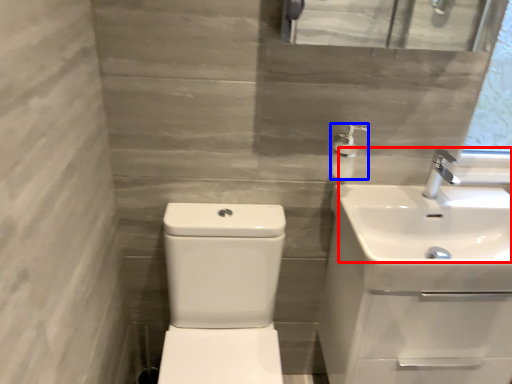
Question: Among these objects, which one is nearest to the camera, sink (highlighted by a red box) or soap dispenser (highlighted by a blue box)?

Choices:
 (A) sink
 (B) soap dispenser

Answer: (A)